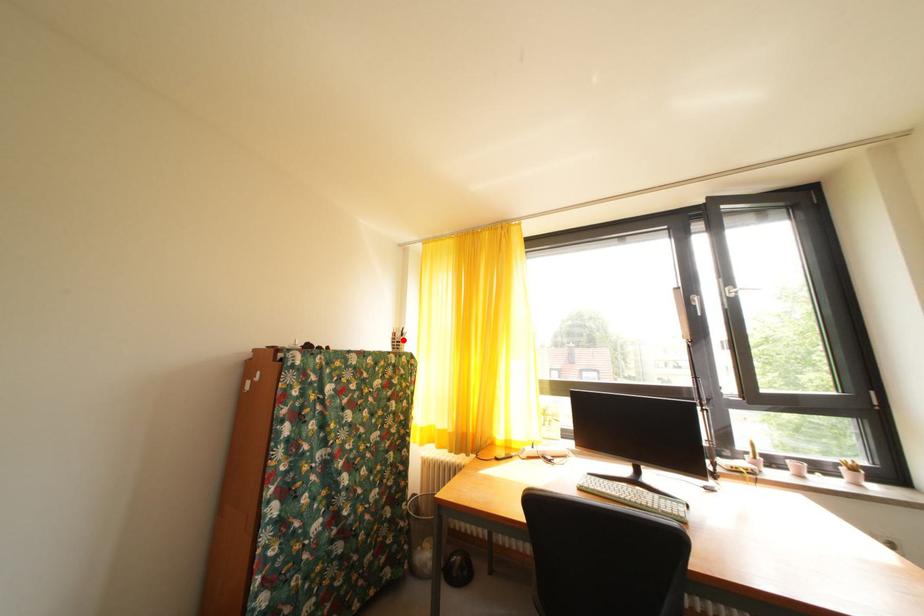
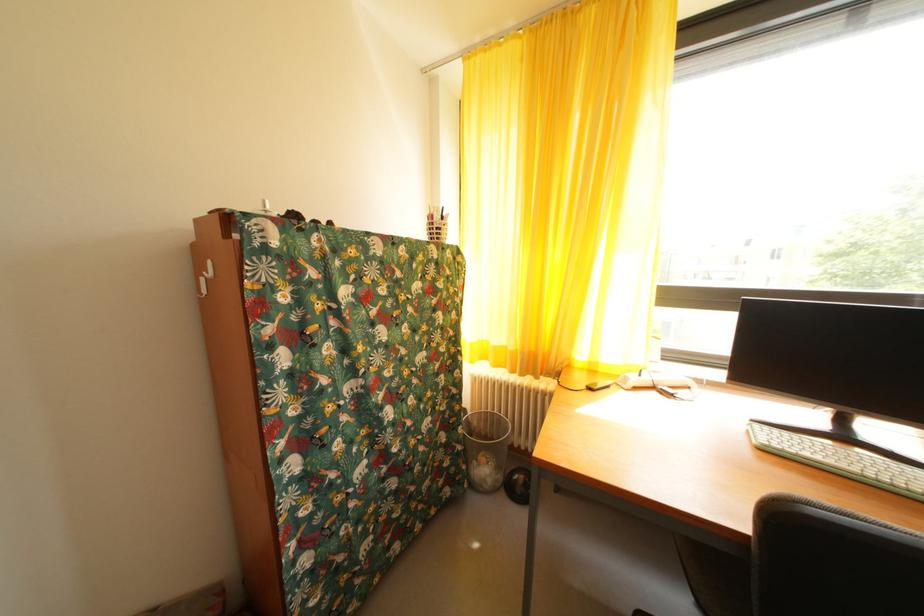
The point at the highlighted location is marked in the first image. Where is the corresponding point in the second image?

(440, 223)